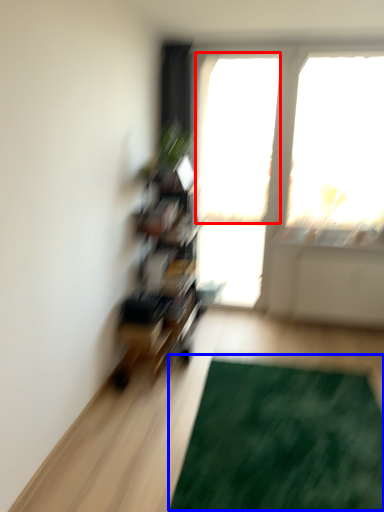
Question: Which object appears closest to the camera in this image, window screen (highlighted by a red box) or doormat (highlighted by a blue box)?

Choices:
 (A) window screen
 (B) doormat

Answer: (B)